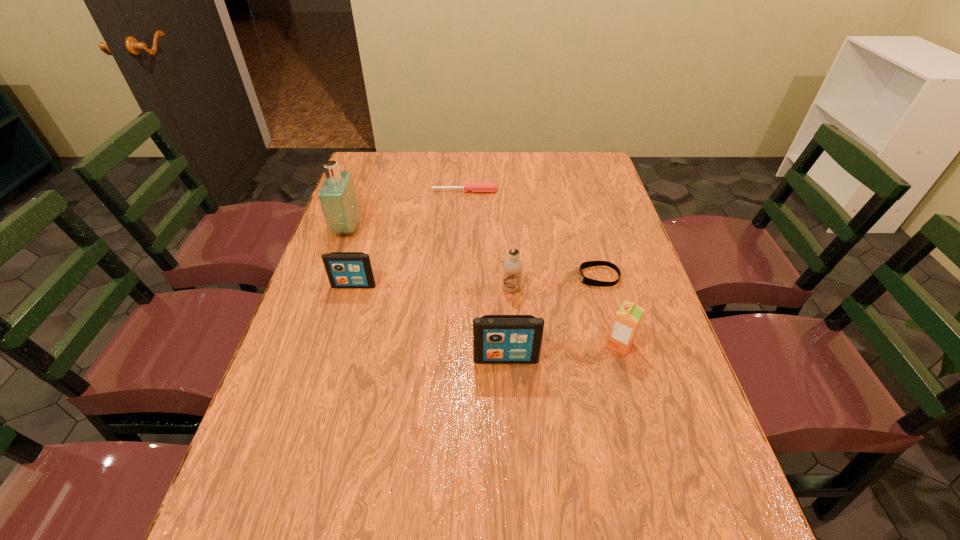
Find the location of a particular element. the shorter iPod is located at coordinates (344, 269).

I want to click on the fifth tallest object, so click(x=344, y=269).

This screenshot has width=960, height=540. I want to click on the nearer iPod, so click(x=497, y=339).

Where is `the right iPod`? the right iPod is located at coordinates (497, 339).

In order to click on chocolate milk in this screenshot , I will do `click(513, 265)`.

Find the location of a particular element. Image resolution: width=960 pixels, height=540 pixels. screwdriver is located at coordinates (476, 187).

You are a GUI agent. You are given a task and a screenshot of the screen. Output one action in this format:
    pyautogui.click(x=<x>, y=<y>)
    Task: Click on the farthest object
    This screenshot has height=540, width=960.
    Given the screenshot: What is the action you would take?
    pos(476,187)

Locate an element on the screen. The height and width of the screenshot is (540, 960). the tallest object is located at coordinates (337, 195).

At what (x,y) coordinates should I click in order to perform the action: click on the sixth nearest object. Please return your answer as a coordinate pair (x, y). This screenshot has width=960, height=540. Looking at the image, I should click on (337, 195).

I want to click on orange juice, so click(628, 318).